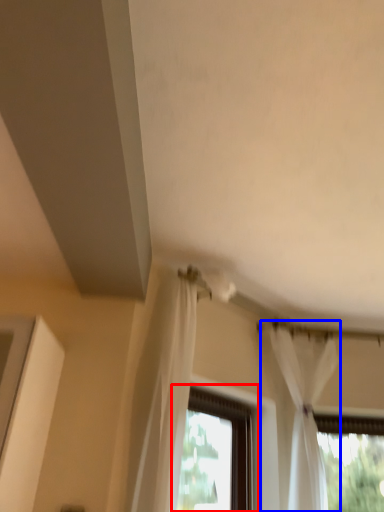
Question: Which of the following is the closest to the observer, window (highlighted by a red box) or curtain (highlighted by a blue box)?

Choices:
 (A) window
 (B) curtain

Answer: (A)